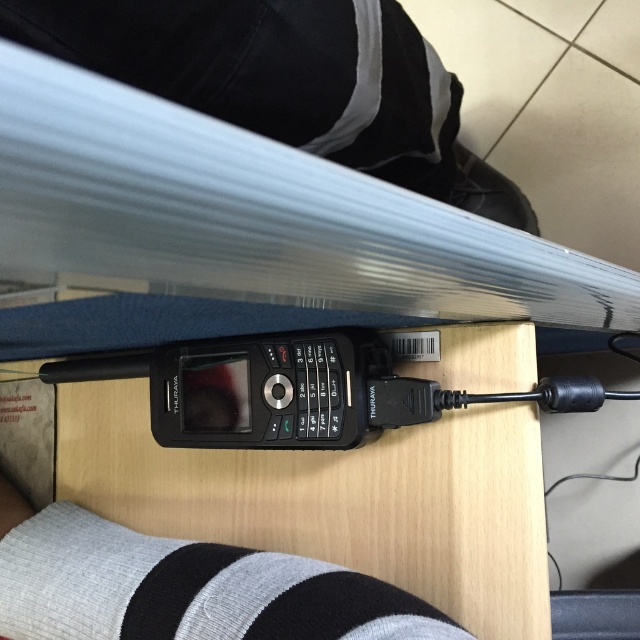
You are a photographer setting up a shot of the Thuraya satellite phone. You notice the black fabric pants at lower center and the gray knitted sock at lower center in the background. Which object should you adjust to avoid covering the phone? Explain your reasoning.

The black fabric pants at lower center is located above the gray knitted sock at lower center. Since the pants are above the sock, adjusting the pants would be more effective in avoiding coverage of the phone, as they are closer to the phone in the lower center area.

Consider the image. You are a tailor measuring the size of the black fabric pants at lower center and the gray knitted sock at lower center. Which item has a larger size?

The black fabric pants at lower center has a larger size compared to the gray knitted sock at lower center.